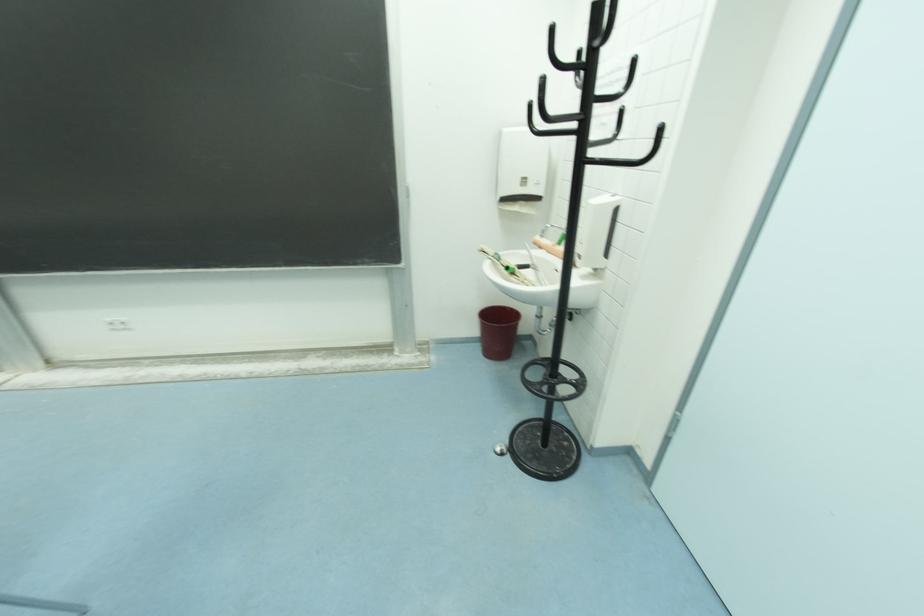
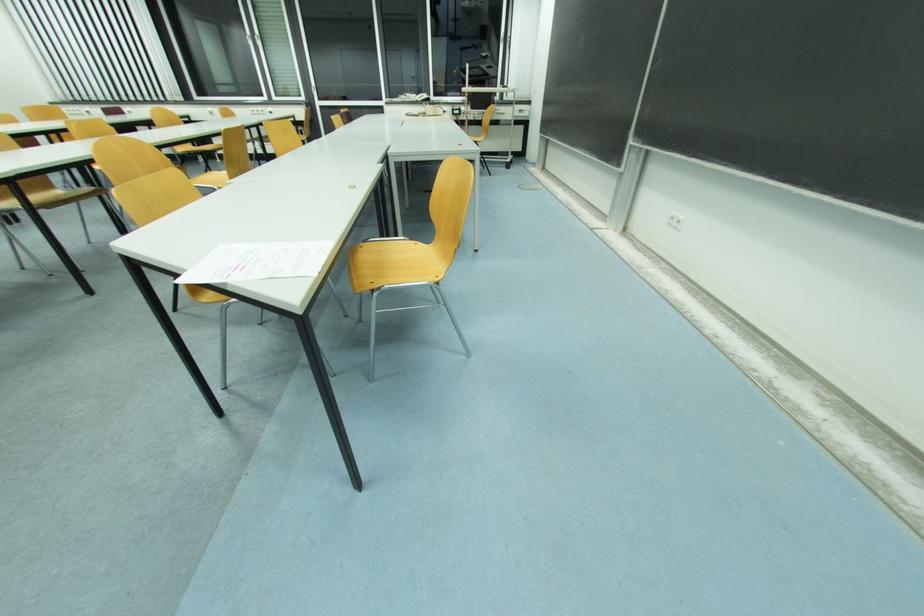
The images are taken continuously from a first-person perspective. In which direction is your viewpoint rotating?

The camera rotated toward left-down.